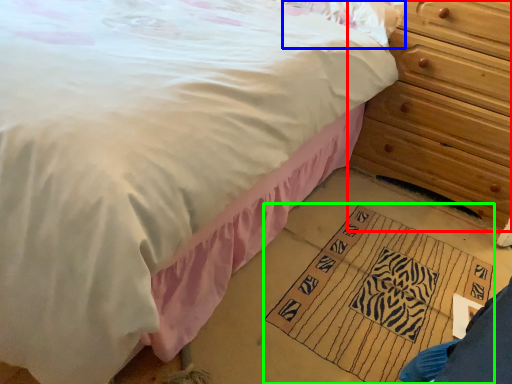
Question: Which is farther away from chest of drawers (highlighted by a red box)? pillow (highlighted by a blue box) or doormat (highlighted by a green box)?

Choices:
 (A) pillow
 (B) doormat

Answer: (B)